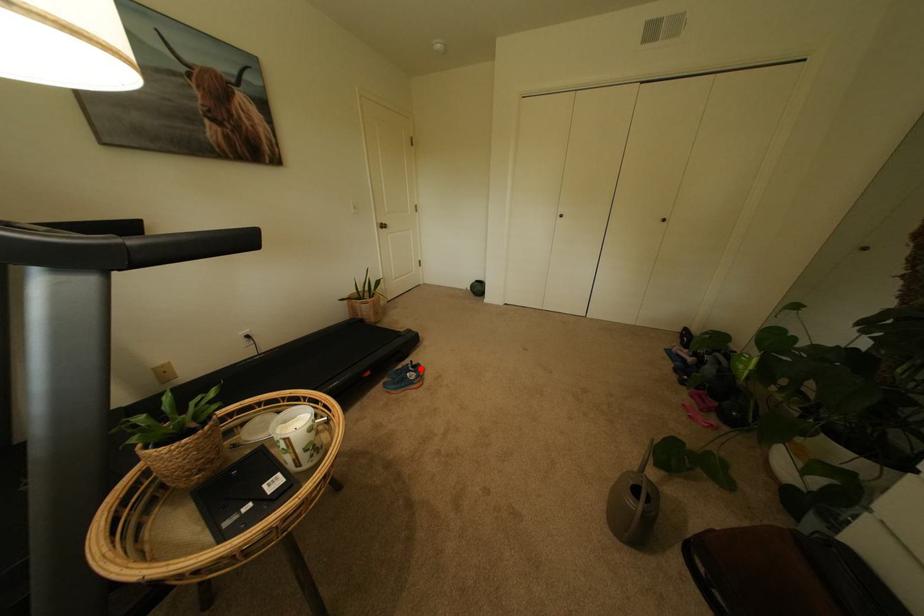
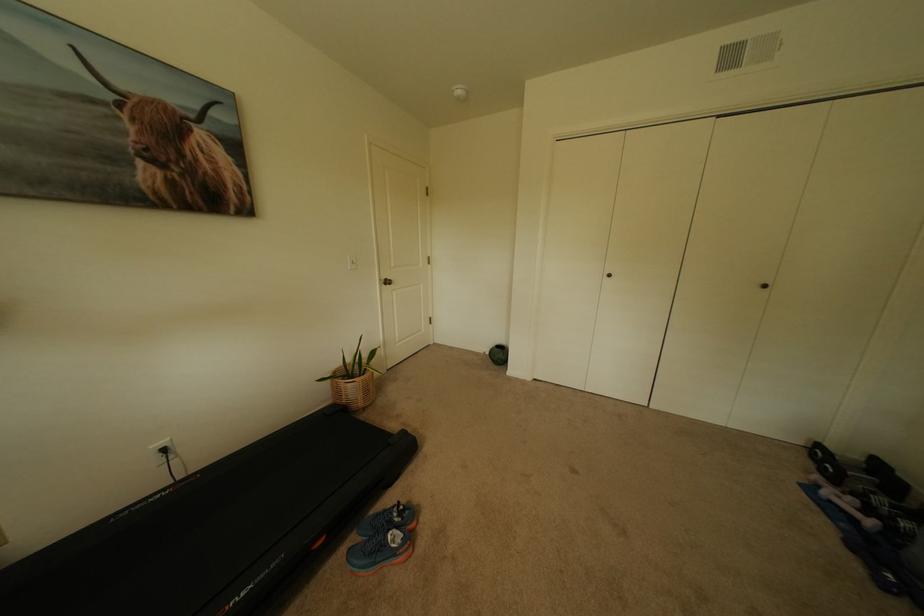
Locate, in the second image, the point that corresponds to the highlighted location in the first image.

(407, 517)